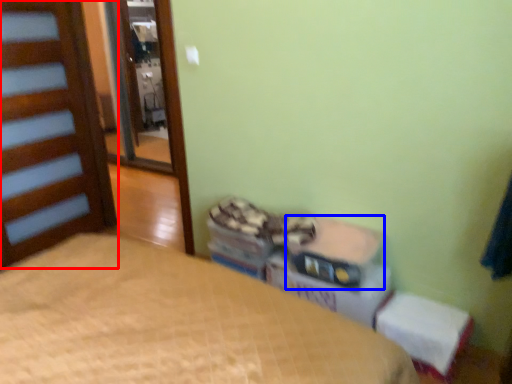
Question: Which of the following is the closest to the observer, door (highlighted by a red box) or storage box (highlighted by a blue box)?

Choices:
 (A) door
 (B) storage box

Answer: (B)